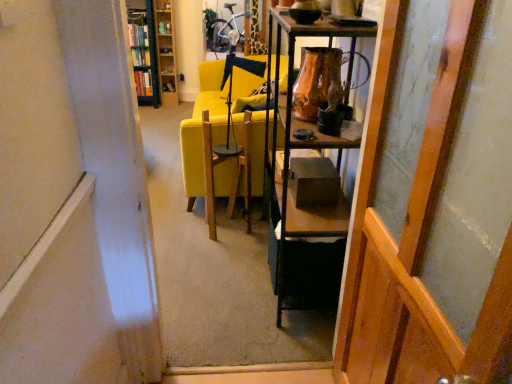
Question: In the image, is yellow fabric couch at center on the left side or the right side of green metal bookshelf at upper left, marked as the first cabinetry in a left-to-right arrangement?

Choices:
 (A) left
 (B) right

Answer: (B)

Question: Does point (224, 89) appear closer or farther from the camera than point (135, 77)?

Choices:
 (A) closer
 (B) farther

Answer: (A)

Question: Which of these objects is positioned closest to the wooden bookshelf at upper left, the 2th cabinetry in the left-to-right sequence?

Choices:
 (A) matte black bowl at upper center
 (B) green metal bookshelf at upper left, marked as the first cabinetry in a left-to-right arrangement
 (C) black matte box at center
 (D) wooden chair at center
 (E) brown glazed vase at upper center

Answer: (B)

Question: Estimate the real-world distances between objects in this image. Which object is closer to the matte black bowl at upper center?

Choices:
 (A) brown glazed vase at upper center
 (B) black matte box at center
 (C) wooden bookshelf at upper left, the 2th cabinetry in the left-to-right sequence
 (D) yellow fabric couch at center
 (E) green metal bookshelf at upper left, which is the 2th cabinetry in right-to-left order

Answer: (A)